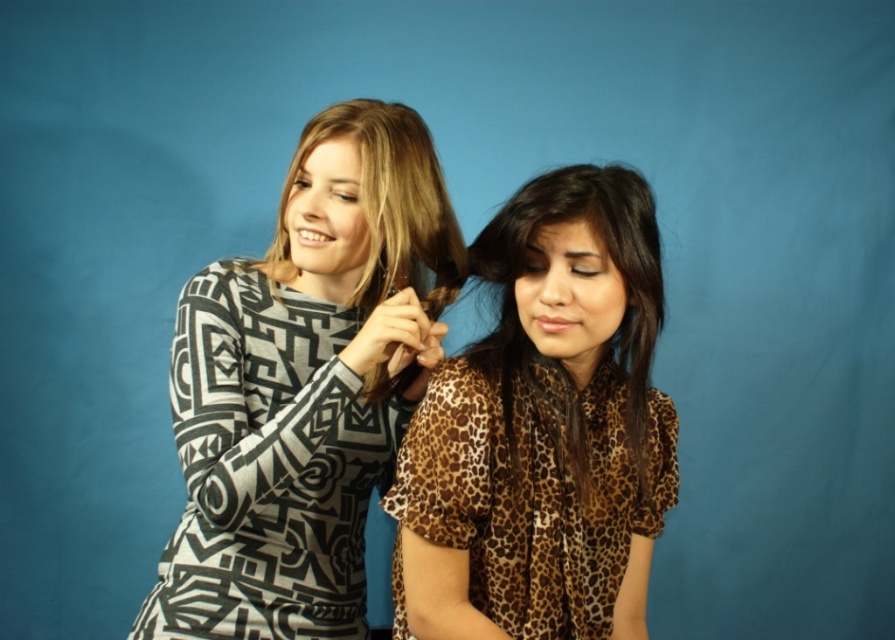
This screenshot has height=640, width=895. Describe the element at coordinates (534, 492) in the screenshot. I see `leopard print fabric shirt at center` at that location.

Is leopard print fabric shirt at center further to the viewer compared to matte black hair at upper center?

No, it is in front of matte black hair at upper center.

Which is behind, point (520, 628) or point (373, 374)?

The point (373, 374) is more distant.

Where is `leopard print fabric shirt at center`? leopard print fabric shirt at center is located at coordinates (534, 492).

Who is positioned more to the right, black and white geometric print dress at left or matte black hair at upper center?

matte black hair at upper center

Between point (240, 467) and point (365, 186), which one is positioned behind?

The point (365, 186) is behind.

The height and width of the screenshot is (640, 895). I want to click on black and white geometric print dress at left, so click(x=268, y=465).

Where is `black and white geometric print dress at left`? This screenshot has width=895, height=640. black and white geometric print dress at left is located at coordinates (268, 465).

Which of these two, leopard print fabric shirt at center or leopard print shirt at center, stands taller?

leopard print shirt at center

Is leopard print fabric shirt at center above leopard print shirt at center?

No.

Which is in front, point (586, 632) or point (658, 310)?

Point (658, 310) is more forward.

I want to click on leopard print fabric shirt at center, so click(534, 492).